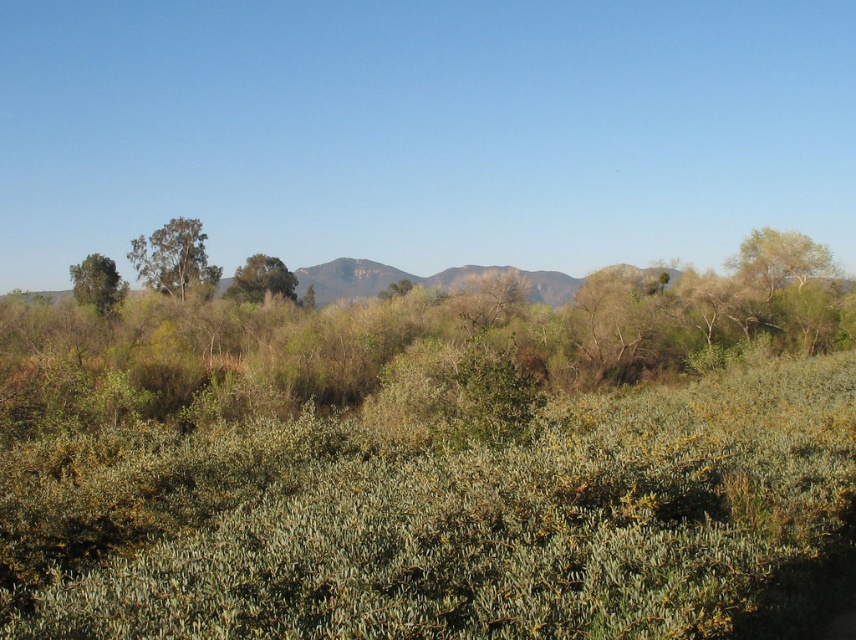
Measure the distance from green leafy tree at upper left to green leafy tree at center.

16.08 feet

Does green leafy tree at upper left have a smaller size compared to green leafy tree at center?

Incorrect, green leafy tree at upper left is not smaller in size than green leafy tree at center.

What do you see at coordinates (174, 259) in the screenshot? The width and height of the screenshot is (856, 640). I see `green leafy tree at upper left` at bounding box center [174, 259].

Locate an element on the screen. green leafy tree at upper left is located at coordinates (174, 259).

Which of these two, green leafy tree at upper right or green leafy tree at left, stands taller?

green leafy tree at upper right

Consider the image. Is green leafy tree at upper right smaller than green leafy tree at left?

Yes, green leafy tree at upper right is smaller than green leafy tree at left.

Is point (768, 273) positioned before point (111, 291)?

No, it is not.

Locate an element on the screen. Image resolution: width=856 pixels, height=640 pixels. green leafy tree at upper right is located at coordinates (779, 259).

Which is in front, point (753, 240) or point (263, 260)?

Point (753, 240) is in front.

In the scene shown: Which is more to the left, green leafy tree at upper right or green leafy tree at center?

From the viewer's perspective, green leafy tree at center appears more on the left side.

Is point (777, 252) closer to camera compared to point (274, 257)?

Yes, it is in front of point (274, 257).

Find the location of a particular element. green leafy tree at upper right is located at coordinates (779, 259).